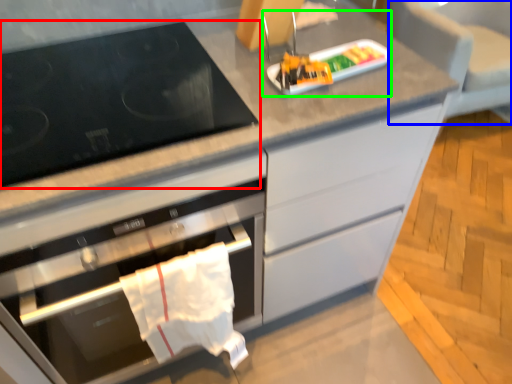
Question: Considering the real-world distances, which object is closest to gas stove (highlighted by a red box)? armchair (highlighted by a blue box) or appliance (highlighted by a green box).

Choices:
 (A) armchair
 (B) appliance

Answer: (B)